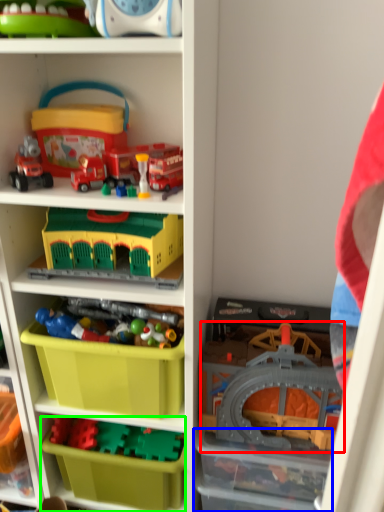
Question: Which is farther away from toy (highlighted by a red box)? storage box (highlighted by a blue box) or storage box (highlighted by a green box)?

Choices:
 (A) storage box
 (B) storage box

Answer: (B)